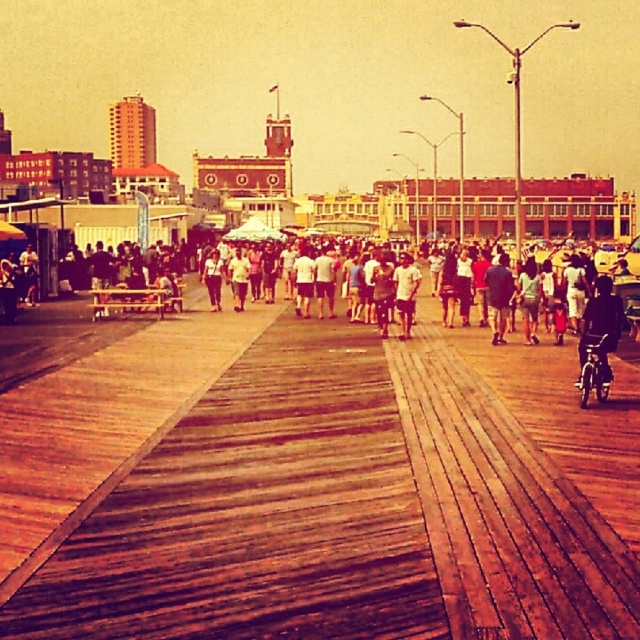
In the scene shown: You are a photographer standing on the wooden boardwalk. You want to take a photo of the wooden at center and the light brown shorts at center. Which object should you zoom in on to ensure both are clearly visible in the frame?

The wooden at center is bigger than light brown shorts at center, so you should zoom in on the wooden at center to ensure both objects are clearly visible in the frame.

You are a photographer trying to capture a candid shot of the light brown shorts at center and the light brown leather jacket at center in the same frame. Considering their sizes, which object would you need to position closer to the camera to ensure both fit in the frame?

The light brown shorts at center occupies less space than light brown leather jacket at center, so you would need to position the light brown shorts at center closer to the camera to ensure both fit in the frame.